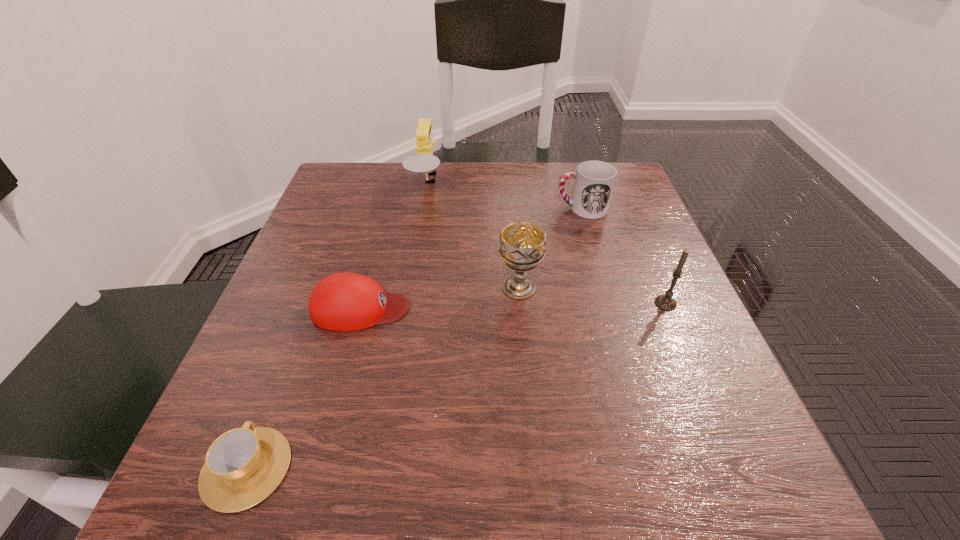
This screenshot has height=540, width=960. What are the coordinates of `vacant region between the fourth object from left to right and the sponge` in the screenshot? It's located at (473, 236).

You are a GUI agent. You are given a task and a screenshot of the screen. Output one action in this format:
    pyautogui.click(x=<x>, y=<y>)
    Task: Click on the unoccupied area between the third object from right to left and the left cup
    
    Given the screenshot: What is the action you would take?
    pyautogui.click(x=383, y=378)

This screenshot has height=540, width=960. I want to click on free spot between the candle and the third object from right to left, so click(592, 295).

Select which object appears as the second closest to the sponge. Please provide its 2D coordinates. Your answer should be formatted as a tuple, i.e. [(x, y)], where the tuple contains the x and y coordinates of a point satisfying the conditions above.

[(344, 301)]

Identify which object is the fourth nearest to the candle. Please provide its 2D coordinates. Your answer should be formatted as a tuple, i.e. [(x, y)], where the tuple contains the x and y coordinates of a point satisfying the conditions above.

[(424, 161)]

The width and height of the screenshot is (960, 540). I want to click on free space that satisfies the following two spatial constraints: 1. on the front-facing side of the sponge; 2. on the left side of the chalice, so click(x=410, y=288).

Locate an element on the screen. The width and height of the screenshot is (960, 540). blank space that satisfies the following two spatial constraints: 1. on the back side of the rightmost object; 2. on the front-facing side of the sponge is located at coordinates (615, 184).

Where is `free spot that satisfies the following two spatial constraints: 1. on the front side of the fourth object from left to right; 2. on the left side of the candle`? free spot that satisfies the following two spatial constraints: 1. on the front side of the fourth object from left to right; 2. on the left side of the candle is located at coordinates (520, 303).

Where is `vacant point that satisfies the following two spatial constraints: 1. on the back side of the chalice; 2. on the handle side of the third shortest object`? The image size is (960, 540). vacant point that satisfies the following two spatial constraints: 1. on the back side of the chalice; 2. on the handle side of the third shortest object is located at coordinates (512, 208).

At what (x,y) coordinates should I click in order to perform the action: click on free space in the image that satisfies the following two spatial constraints: 1. on the handle side of the third shortest object; 2. on the front-facing side of the sponge. Please return your answer as a coordinate pair (x, y). The height and width of the screenshot is (540, 960). Looking at the image, I should click on (574, 184).